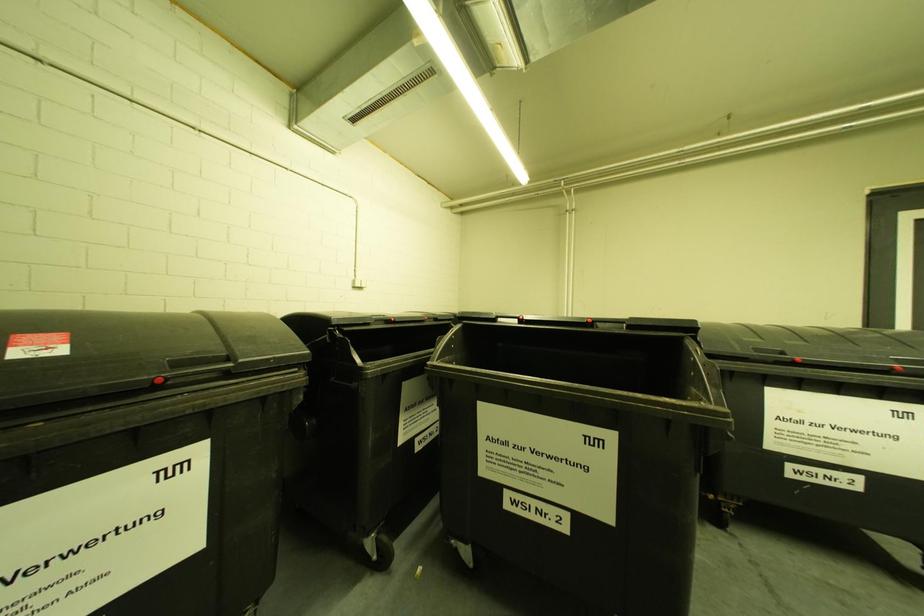
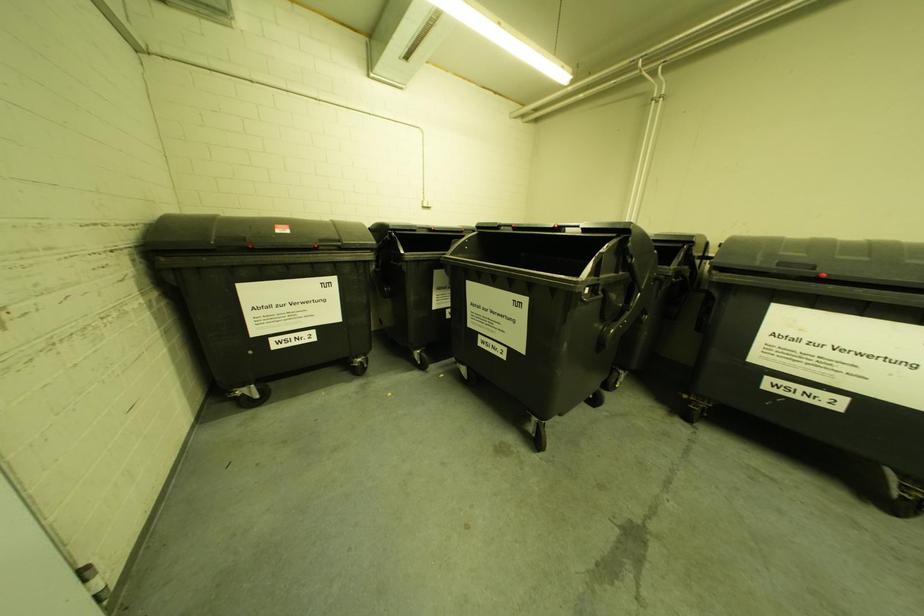
Which direction would the cameraman need to move to produce the second image?

The movement direction of the cameraman is right, backward.